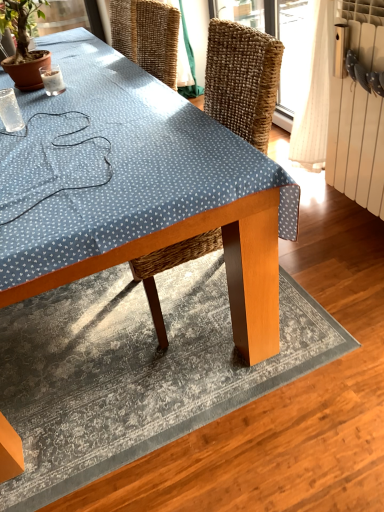
You are a GUI agent. You are given a task and a screenshot of the screen. Output one action in this format:
    pyautogui.click(x=<x>, y=<y>)
    Task: Click on the vacant space in front of green leafy plant at upper left
    The height and width of the screenshot is (512, 384).
    Given the screenshot: What is the action you would take?
    pyautogui.click(x=58, y=104)